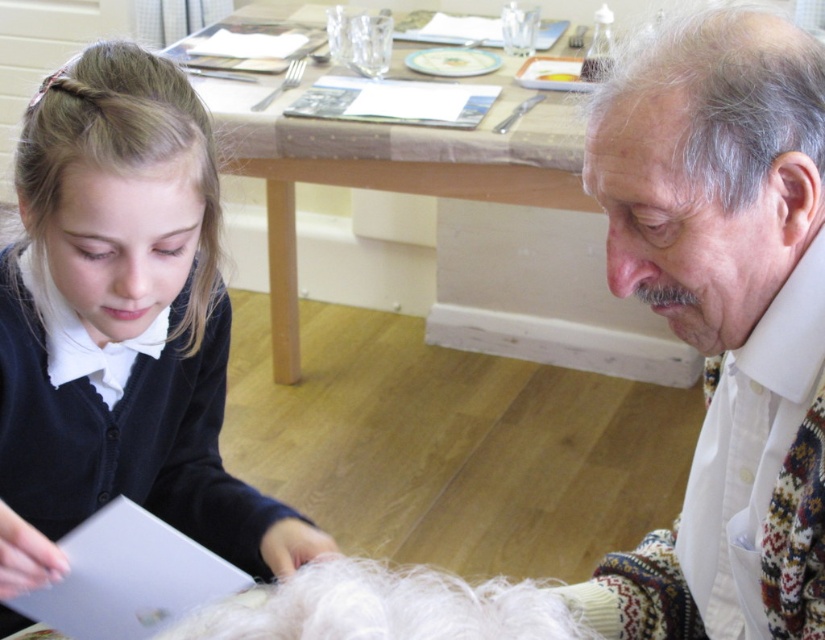
You are a photographer trying to capture a closeup of the gray matte hair at upper right without the white textured scarf at right appearing in the frame. Is this possible given their sizes?

The white textured scarf at right is bigger than the gray matte hair at upper right, so it might block the view. Adjust your angle to ensure the scarf doesn not cover the hair.